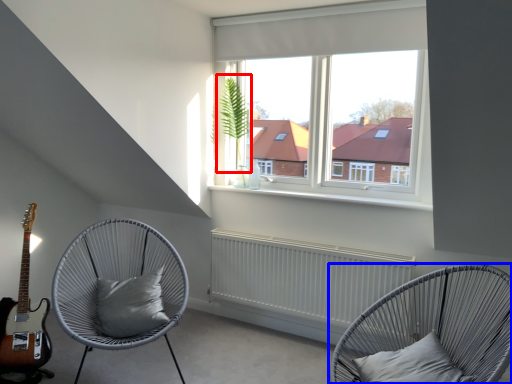
Question: Which of the following is the farthest to the observer, plant (highlighted by a red box) or chair (highlighted by a blue box)?

Choices:
 (A) plant
 (B) chair

Answer: (A)